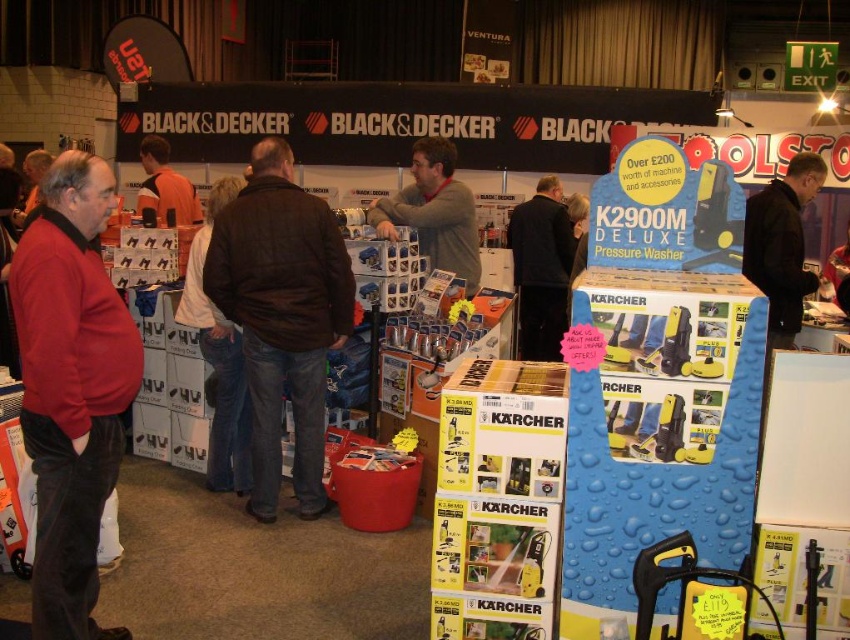
You are a photographer at the event and want to capture both the brown quilted jacket at center and the orange fabric shirt at center in a single photo. Which object should you focus on first to ensure both are in frame?

You should focus on the brown quilted jacket at center first since it is larger than the orange fabric shirt at center, ensuring it fits within the frame while the smaller shirt remains visible.